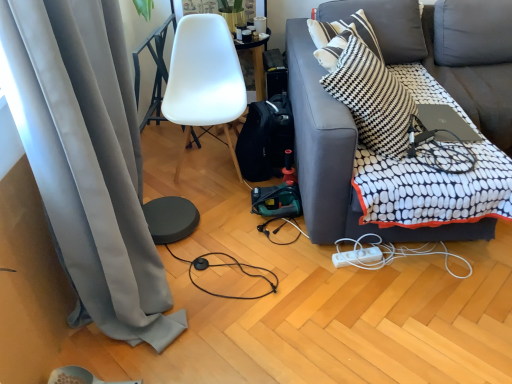
Identify the location of empty space that is in between gray fabric curtain at left and black cable at lower center. This screenshot has height=384, width=512. (223, 329).